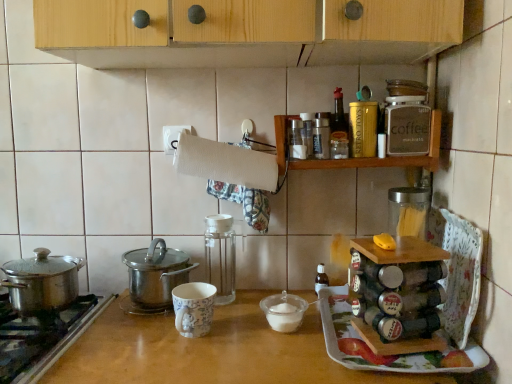
This screenshot has width=512, height=384. In order to click on vacant area that is in front of metallic silver spice rack at center right, the first appliance when ordered from right to left in this screenshot , I will do `click(411, 366)`.